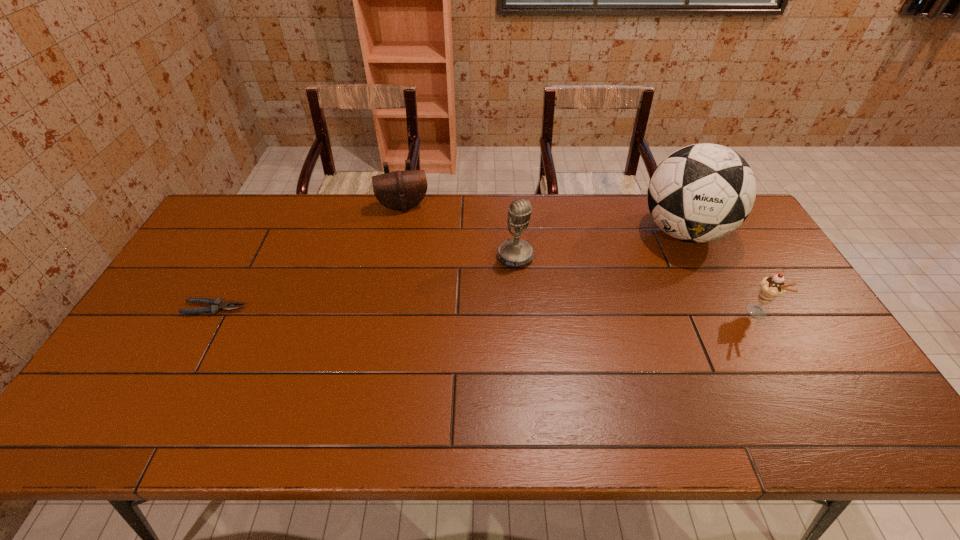
Locate an element on the screen. free space on the desktop that is between the shortest object and the icecream and is positioned with the flap open on the pouch is located at coordinates (423, 310).

Identify the location of free space on the desktop that is between the pliers and the icecream and is positioned on the front-facing side of the third object from right to left. The height and width of the screenshot is (540, 960). (553, 312).

I want to click on free space on the desktop that is between the pliers and the icecream and is positioned on the surface of the soccer ball where the brand logo is visible, so click(x=563, y=312).